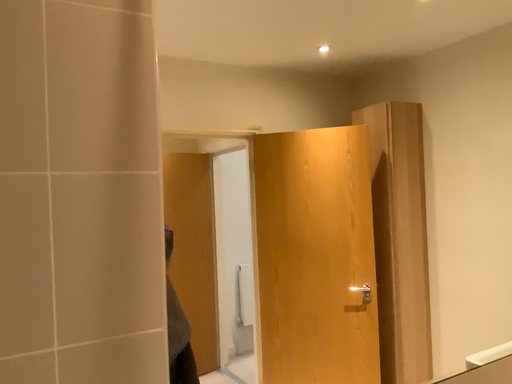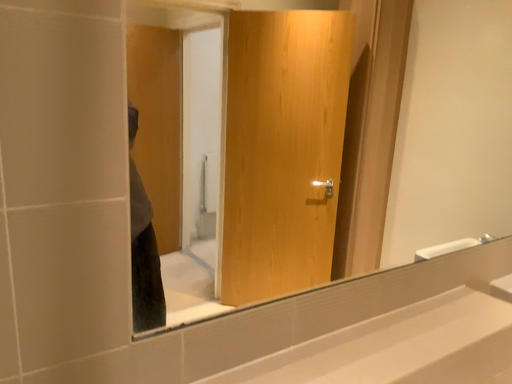
Question: Which way did the camera rotate in the video?

Choices:
 (A) rotated upward
 (B) rotated downward

Answer: (B)